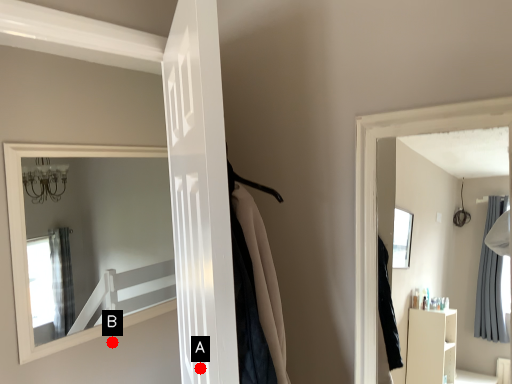
Question: Two points are circled on the image, labeled by A and B beside each circle. Which point is closer to the camera taking this photo?

Choices:
 (A) A is closer
 (B) B is closer

Answer: (A)